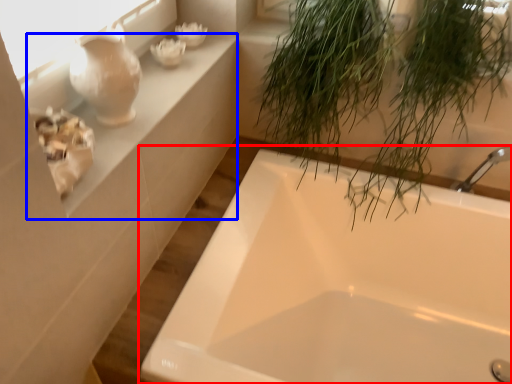
Question: Which of the following is the farthest to the observer, bathtub (highlighted by a red box) or window sill (highlighted by a blue box)?

Choices:
 (A) bathtub
 (B) window sill

Answer: (B)